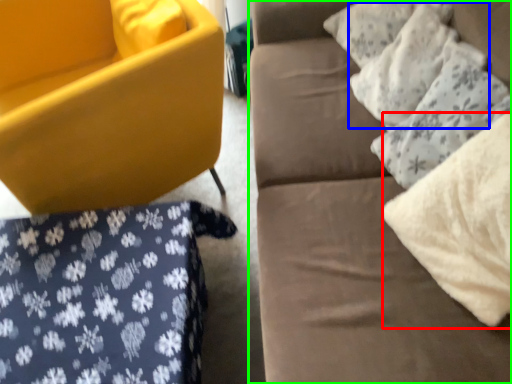
Question: Based on their relative distances, which object is farther from material (highlighted by a red box)? Choose from pillow (highlighted by a blue box) and studio couch (highlighted by a green box).

Choices:
 (A) pillow
 (B) studio couch

Answer: (A)